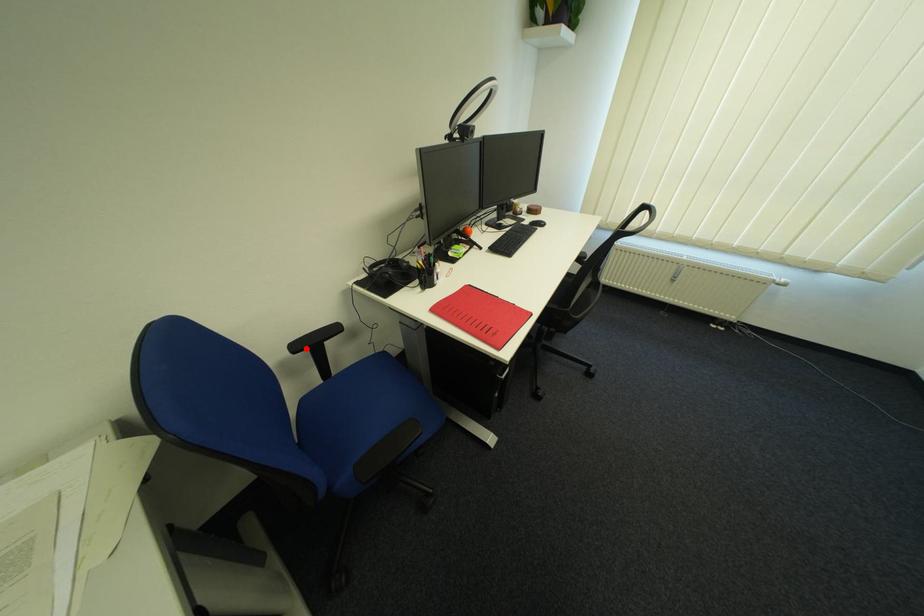
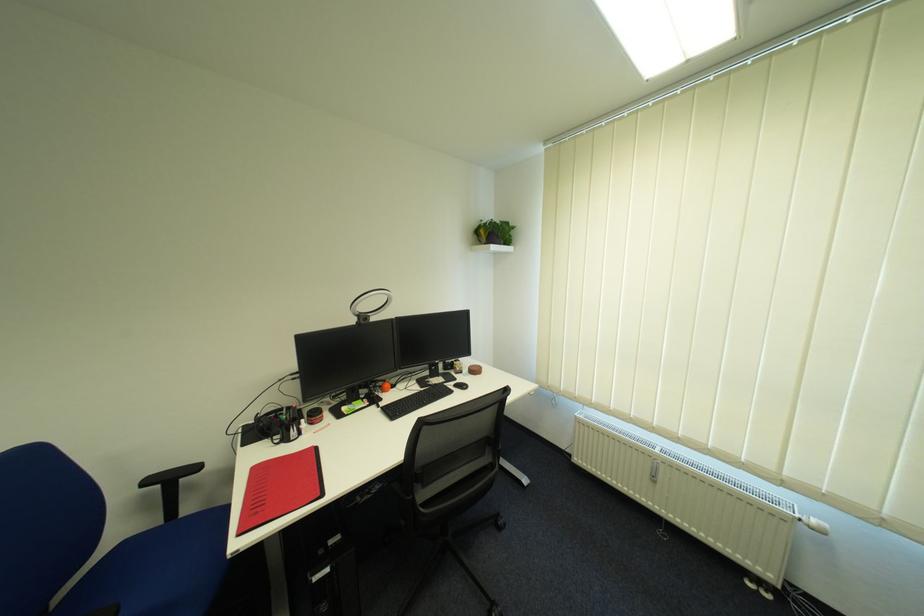
Question: I am providing you with two images of the same scene from different viewpoints. Image1 has a red point marked. In image2, the corresponding 3D location appears at what relative position? Reply with the corresponding letter.

Choices:
 (A) Closer
 (B) Farther

Answer: (A)